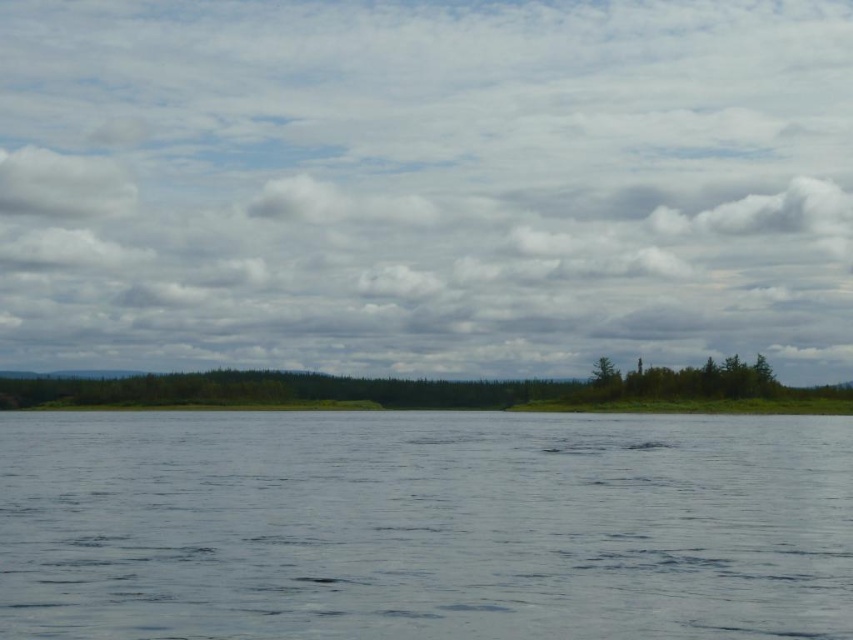
Does cloudy sky at center have a smaller size compared to clear water at center?

No.

Can you confirm if cloudy sky at center is positioned to the right of clear water at center?

No, cloudy sky at center is not to the right of clear water at center.

Locate an element on the screen. cloudy sky at center is located at coordinates 425,182.

I want to click on cloudy sky at center, so click(425, 182).

Who is taller, clear water at center or green matte tree at upper right?

Standing taller between the two is clear water at center.

Which is more to the right, clear water at center or green matte tree at upper right?

Positioned to the right is green matte tree at upper right.

Does point (577, 614) come closer to viewer compared to point (605, 376)?

Yes, point (577, 614) is closer to viewer.

Find the location of `clear water at center`. clear water at center is located at coordinates (424, 525).

Who is positioned more to the left, green matte trees at center or green matte tree at upper right?

Positioned to the left is green matte tree at upper right.

Can you confirm if green matte trees at center is smaller than green matte tree at upper right?

Incorrect, green matte trees at center is not smaller in size than green matte tree at upper right.

The width and height of the screenshot is (853, 640). What do you see at coordinates (686, 380) in the screenshot?
I see `green matte trees at center` at bounding box center [686, 380].

Identify the location of green matte trees at center. The width and height of the screenshot is (853, 640). (686, 380).